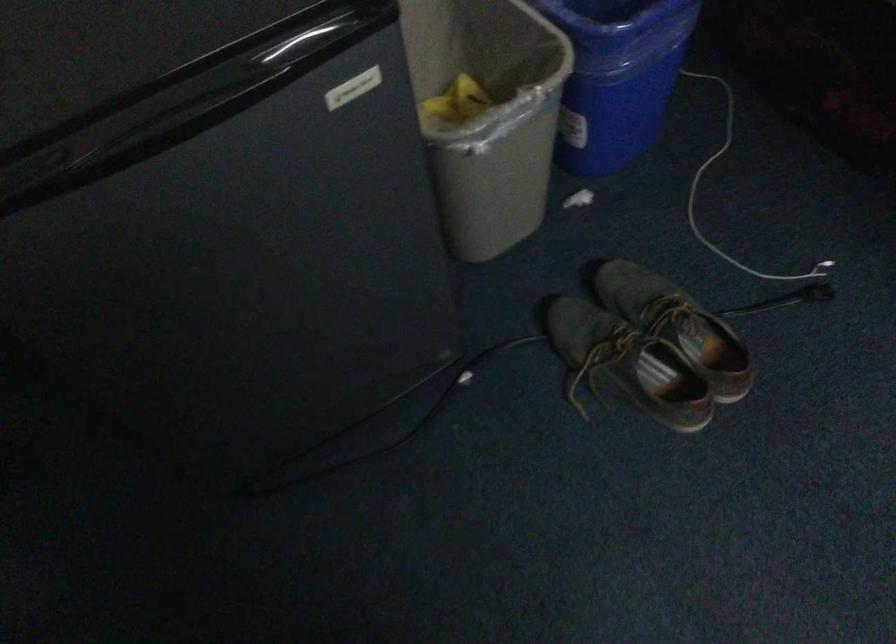
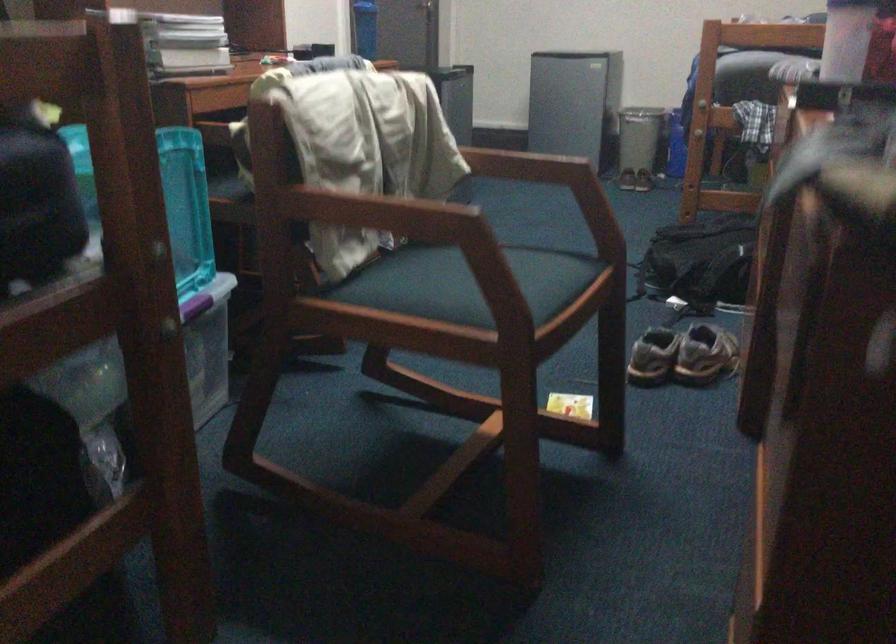
Find the pixel in the second image that matches [716,328] in the first image.

(638, 146)